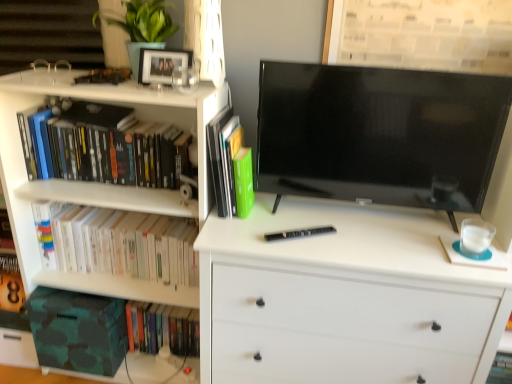
Where is `free point below black glossy tv at center (from a real-world perspective)`? free point below black glossy tv at center (from a real-world perspective) is located at coordinates (377, 216).